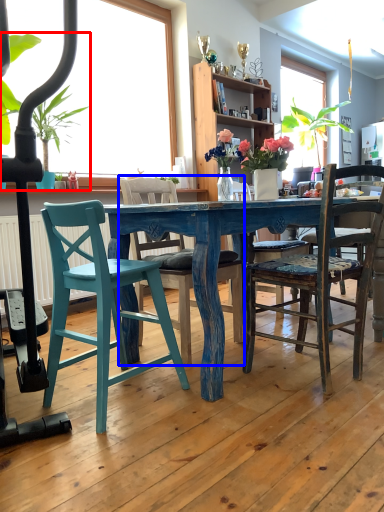
Question: Among these objects, which one is farthest to the camera, houseplant (highlighted by a red box) or chair (highlighted by a blue box)?

Choices:
 (A) houseplant
 (B) chair

Answer: (A)